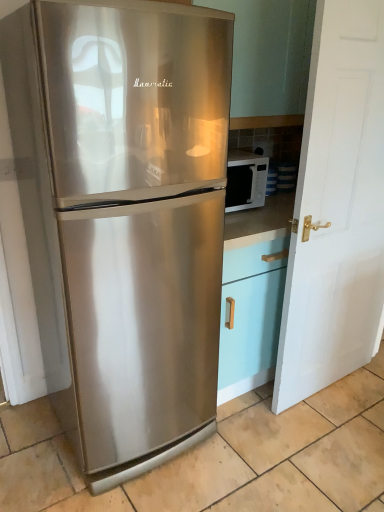
Locate an element on the screen. vacant area situated below white matte door at right (from a real-world perspective) is located at coordinates (325, 385).